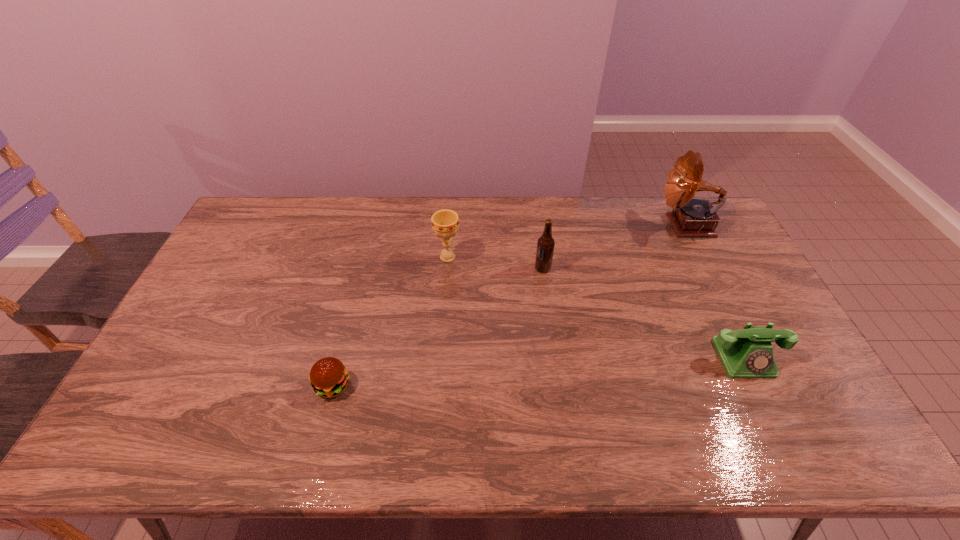
This screenshot has height=540, width=960. In order to click on the farthest object in this screenshot , I will do `click(692, 217)`.

Where is `the tallest object`? The width and height of the screenshot is (960, 540). the tallest object is located at coordinates (692, 217).

This screenshot has height=540, width=960. In order to click on the second tallest object in this screenshot , I will do `click(545, 246)`.

What are the coordinates of `the third object from right to left` in the screenshot? It's located at (545, 246).

The image size is (960, 540). I want to click on the second object from left to right, so click(x=445, y=223).

Locate an element on the screen. This screenshot has height=540, width=960. the third shortest object is located at coordinates (445, 223).

The image size is (960, 540). I want to click on the fourth tallest object, so click(748, 353).

I want to click on the shortest object, so tap(329, 377).

The height and width of the screenshot is (540, 960). Find the location of `the leftmost object`. the leftmost object is located at coordinates (329, 377).

At what (x,y) coordinates should I click in order to perform the action: click on vacant area situated on the horn of the farthest object. Please return your answer as a coordinate pair (x, y). The width and height of the screenshot is (960, 540). Looking at the image, I should click on click(592, 225).